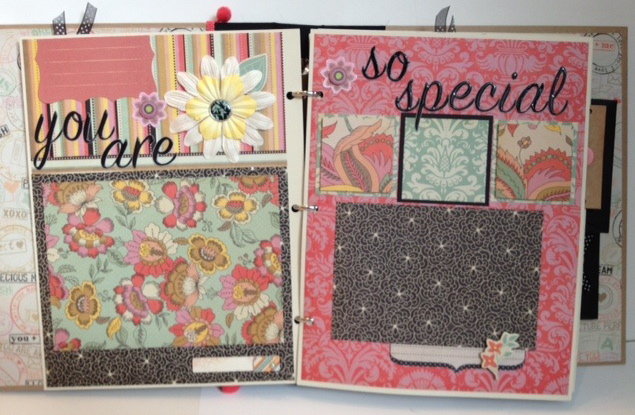
What are the coordinates of `inside of binder covers` in the screenshot? It's located at (605, 63), (605, 317), (23, 353), (9, 128).